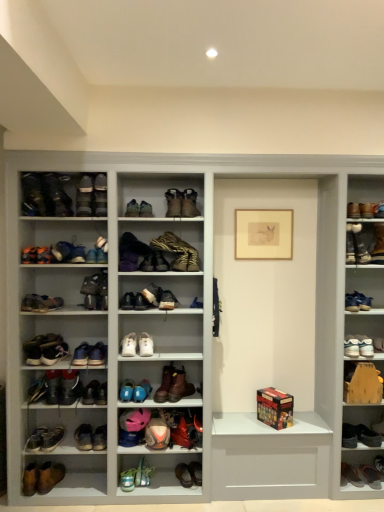
Find the location of a particular element. free space above shiny black shoes at lower left, arranged as the first footwear when viewed from the left (from a real-world perspective) is located at coordinates (46, 378).